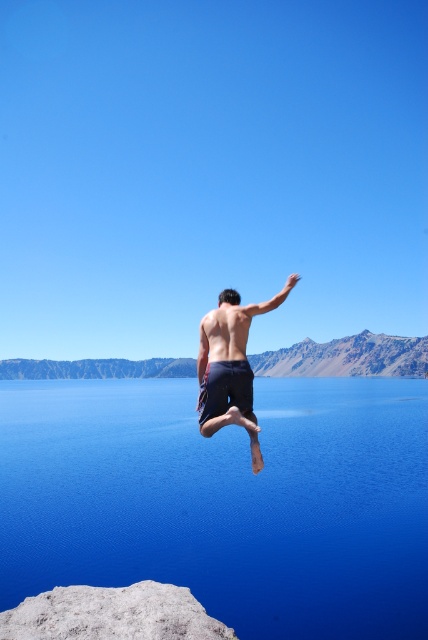
You are standing at the edge of the cliff and want to know how far the point marked as point (x=94, y=625) is from your current position. Can you determine the distance?

The point marked as point (x=94, y=625) is 95.06 feet away from the camera, so the distance from your current position at the edge of the cliff to that point is 95.06 feet.